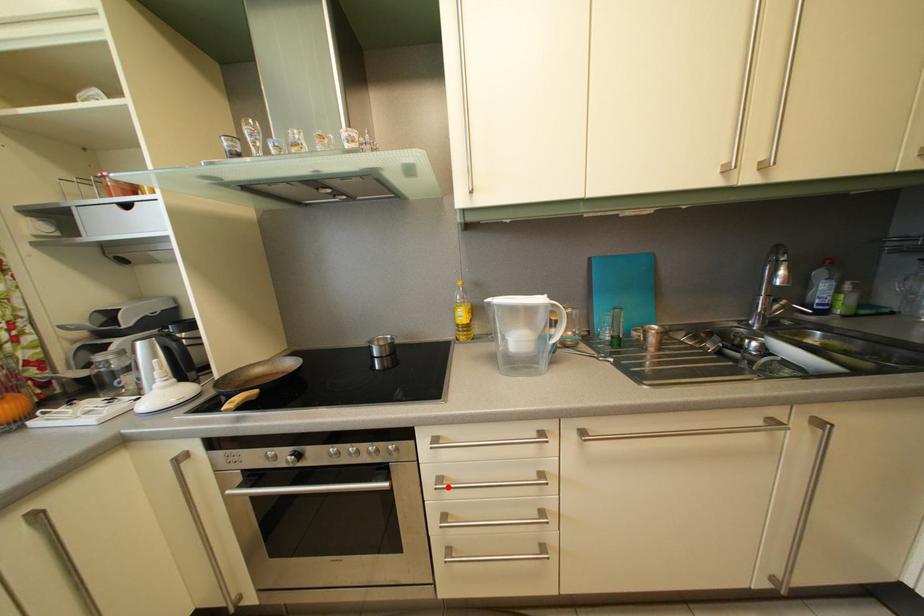
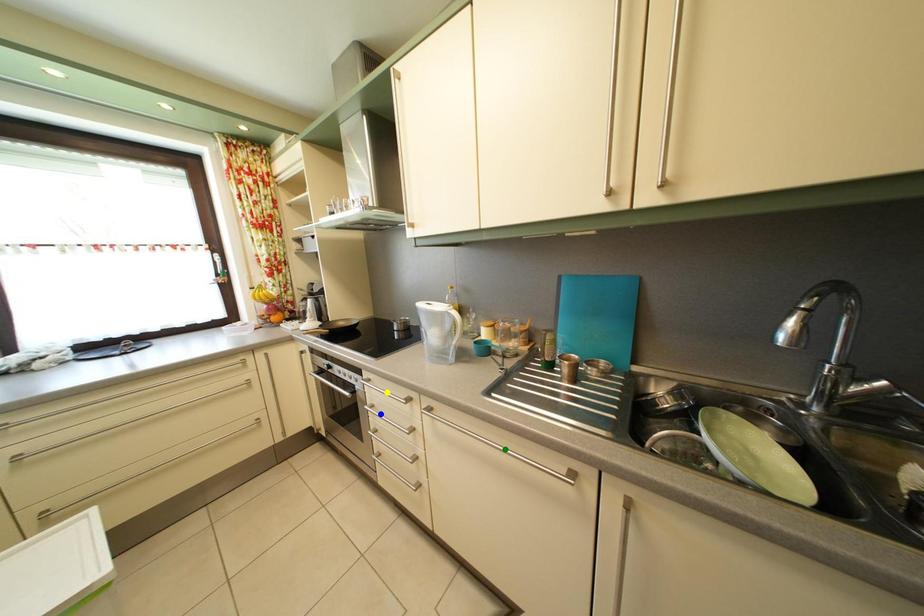
Question: I am providing you with two images of the same scene from different viewpoints. A red point is marked on the first image. You are given multiple points on the second image. Which spot in image 2 lines up with the point in image 1?

Choices:
 (A) green point
 (B) blue point
 (C) yellow point

Answer: (B)